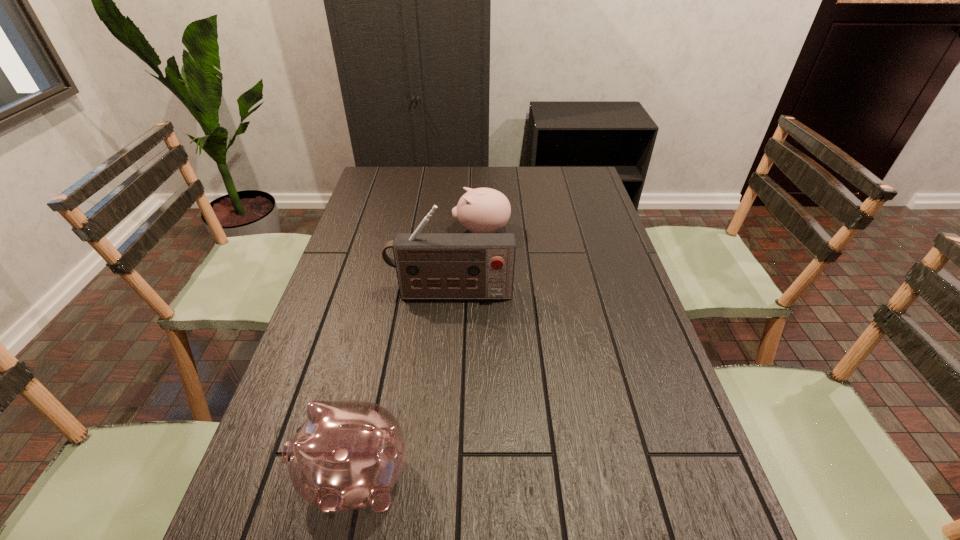
Find the location of a particular element. This screenshot has width=960, height=540. vacant space that satisfies the following two spatial constraints: 1. at the snout of the right piggy bank; 2. on the front panel of the radio receiver is located at coordinates (482, 294).

Find the location of a particular element. blank space that satisfies the following two spatial constraints: 1. on the front panel of the tallest object; 2. on the front facing side of the left piggy bank is located at coordinates (438, 477).

Where is `vacant area in the image that satisfies the following two spatial constraints: 1. on the front panel of the tallest object; 2. on the front facing side of the nearer piggy bank`? Image resolution: width=960 pixels, height=540 pixels. vacant area in the image that satisfies the following two spatial constraints: 1. on the front panel of the tallest object; 2. on the front facing side of the nearer piggy bank is located at coordinates click(x=438, y=477).